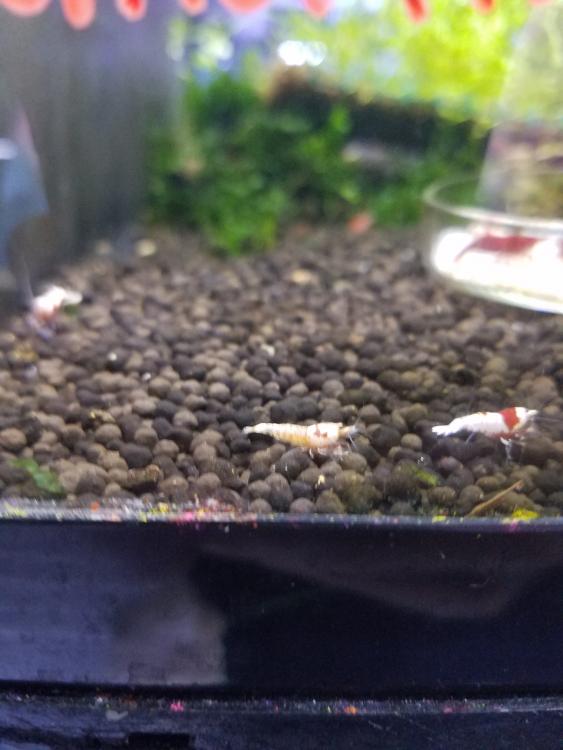
Where is `glass`? The height and width of the screenshot is (750, 563). glass is located at coordinates (98, 436).